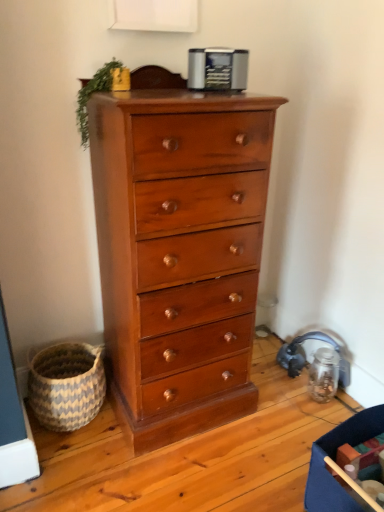
This screenshot has height=512, width=384. Describe the element at coordinates (217, 69) in the screenshot. I see `metallic silver toaster at upper center` at that location.

Identify the location of metallic silver toaster at upper center. The height and width of the screenshot is (512, 384). (217, 69).

Describe the element at coordinates (335, 460) in the screenshot. I see `blue fabric storage box at lower right` at that location.

Measure the distance between point [359,415] and camera.

A distance of 4.43 feet exists between point [359,415] and camera.

Find the location of `metallic silver toaster at upper center`. metallic silver toaster at upper center is located at coordinates (217, 69).

Is blue fabric storage box at lower right surrounding metallic silver toaster at upper center?

Definitely not — metallic silver toaster at upper center is not inside blue fabric storage box at lower right.

Can you confirm if blue fabric storage box at lower right is positioned to the right of metallic silver toaster at upper center?

Correct, you'll find blue fabric storage box at lower right to the right of metallic silver toaster at upper center.

Does point (350, 502) come closer to viewer compared to point (189, 80)?

Yes.

From a real-world perspective, between blue fabric storage box at lower right and metallic silver toaster at upper center, who is vertically higher?

In real-world perspective, metallic silver toaster at upper center is above.

From the image's perspective, which is above, shiny brown wood chest of drawers at center or green leafy plant at top left?

green leafy plant at top left appears higher in the image.

Is shiny brown wood chest of drawers at center closer to camera compared to green leafy plant at top left?

Yes, it is in front of green leafy plant at top left.

Looking at their sizes, would you say shiny brown wood chest of drawers at center is wider or thinner than green leafy plant at top left?

In the image, shiny brown wood chest of drawers at center appears to be wider than green leafy plant at top left.

Is point (110, 209) closer or farther from the camera than point (109, 63)?

Point (110, 209) is closer to the camera than point (109, 63).

Which is correct: metallic silver toaster at upper center is inside green leafy plant at top left, or outside of it?

metallic silver toaster at upper center is not inside green leafy plant at top left, it's outside.

Which is more to the left, metallic silver toaster at upper center or green leafy plant at top left?

green leafy plant at top left.

Can you tell me how much metallic silver toaster at upper center and green leafy plant at top left differ in facing direction?

26.1 degrees.

Between metallic silver toaster at upper center and green leafy plant at top left, which one has less height?

Standing shorter between the two is metallic silver toaster at upper center.

From the image's perspective, between green leafy plant at top left and blue fabric storage box at lower right, which one is located above?

green leafy plant at top left is shown above in the image.

Does green leafy plant at top left turn towards blue fabric storage box at lower right?

No, green leafy plant at top left is not turned towards blue fabric storage box at lower right.

You are a GUI agent. You are given a task and a screenshot of the screen. Output one action in this format:
    pyautogui.click(x=<x>, y=<y>)
    Task: Click on the storage box on the right side of green leafy plant at top left
    This screenshot has width=384, height=512.
    Given the screenshot: What is the action you would take?
    pyautogui.click(x=335, y=460)

Is green leafy plant at top left spatially inside blue fabric storage box at lower right, or outside of it?

green leafy plant at top left exists outside the volume of blue fabric storage box at lower right.

Which of these two, shiny brown wood chest of drawers at center or blue fabric storage box at lower right, is bigger?

shiny brown wood chest of drawers at center.

How different are the orientations of shiny brown wood chest of drawers at center and blue fabric storage box at lower right in degrees?

They differ by 87.1 degrees in their facing directions.

Is point (234, 286) positioned in front of point (364, 411)?

No.

Considering the positions of objects blue fabric storage box at lower right and blue and white woven basket at lower left in the image provided, who is more to the left, blue fabric storage box at lower right or blue and white woven basket at lower left?

Positioned to the left is blue and white woven basket at lower left.

Is blue fabric storage box at lower right oriented away from blue and white woven basket at lower left?

No.

Considering the positions of points (324, 507) and (28, 379), is point (324, 507) closer to camera compared to point (28, 379)?

Yes, it is.

From the image's perspective, who appears lower, blue and white woven basket at lower left or green leafy plant at top left?

blue and white woven basket at lower left.

Can you see blue and white woven basket at lower left touching green leafy plant at top left?

No, blue and white woven basket at lower left is not in contact with green leafy plant at top left.

Identify the location of plant on the right of blue and white woven basket at lower left. This screenshot has width=384, height=512. click(x=91, y=94).

Considering the relative sizes of blue and white woven basket at lower left and green leafy plant at top left in the image provided, is blue and white woven basket at lower left taller than green leafy plant at top left?

Yes.

The image size is (384, 512). In the image, there is a metallic silver toaster at upper center. Find the location of `storage box below it (from the image's perspective)`. storage box below it (from the image's perspective) is located at coordinates (335, 460).

At what (x,y) coordinates should I click in order to perform the action: click on the chest of drawers beneath the green leafy plant at top left (from a real-world perspective). Please return your answer as a coordinate pair (x, y). The height and width of the screenshot is (512, 384). Looking at the image, I should click on (179, 253).

When comparing their distances from metallic silver toaster at upper center, does blue and white woven basket at lower left or shiny brown wood chest of drawers at center seem further?

Among the two, blue and white woven basket at lower left is located further to metallic silver toaster at upper center.

Which object lies further to the anchor point blue fabric storage box at lower right, blue and white woven basket at lower left or green leafy plant at top left?

green leafy plant at top left is positioned further to the anchor blue fabric storage box at lower right.

Based on their spatial positions, is metallic silver toaster at upper center or blue and white woven basket at lower left closer to shiny brown wood chest of drawers at center?

Among the two, blue and white woven basket at lower left is located nearer to shiny brown wood chest of drawers at center.

Based on their spatial positions, is blue and white woven basket at lower left or metallic silver toaster at upper center closer to blue fabric storage box at lower right?

Based on the image, blue and white woven basket at lower left appears to be nearer to blue fabric storage box at lower right.

From the image, which object appears to be nearer to green leafy plant at top left, blue fabric storage box at lower right or shiny brown wood chest of drawers at center?

Among the two, shiny brown wood chest of drawers at center is located nearer to green leafy plant at top left.

Looking at the image, which one is located further to shiny brown wood chest of drawers at center, metallic silver toaster at upper center or green leafy plant at top left?

Based on the image, metallic silver toaster at upper center appears to be further to shiny brown wood chest of drawers at center.

Considering their positions, is shiny brown wood chest of drawers at center positioned closer to blue fabric storage box at lower right than blue and white woven basket at lower left?

shiny brown wood chest of drawers at center is closer to blue fabric storage box at lower right.

From the image, which object appears to be farther from green leafy plant at top left, blue fabric storage box at lower right or metallic silver toaster at upper center?

blue fabric storage box at lower right.

The image size is (384, 512). In order to click on basket between green leafy plant at top left and blue fabric storage box at lower right in the vertical direction in this screenshot , I will do `click(67, 385)`.

I want to click on the chest of drawers between green leafy plant at top left and blue fabric storage box at lower right vertically, so click(179, 253).

Image resolution: width=384 pixels, height=512 pixels. Identify the location of chest of drawers between blue and white woven basket at lower left and blue fabric storage box at lower right in the horizontal direction. (179, 253).

At what (x,y) coordinates should I click in order to perform the action: click on plant between metallic silver toaster at upper center and blue and white woven basket at lower left in the vertical direction. Please return your answer as a coordinate pair (x, y). Looking at the image, I should click on (91, 94).